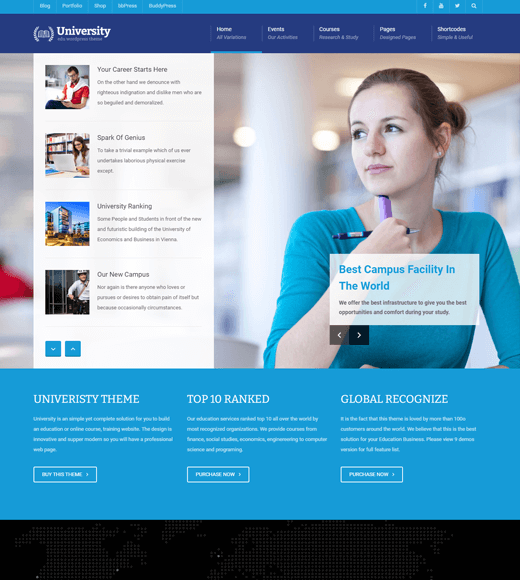
Locate an element on the screen. The image size is (520, 580). pen is located at coordinates (368, 232).